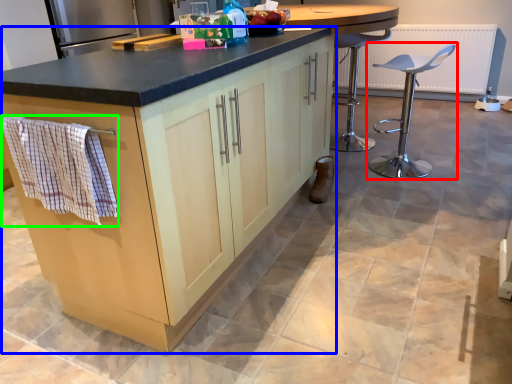
Question: Estimate the real-world distances between objects in this image. Which object is closer to chair (highlighted by a red box), cabinetry (highlighted by a blue box) or hand towel (highlighted by a green box)?

Choices:
 (A) cabinetry
 (B) hand towel

Answer: (A)